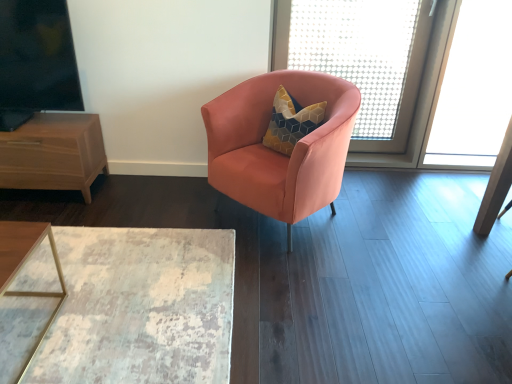
This screenshot has height=384, width=512. What are the coordinates of `vacant region to the left of satin peach armchair at center` in the screenshot? It's located at (167, 202).